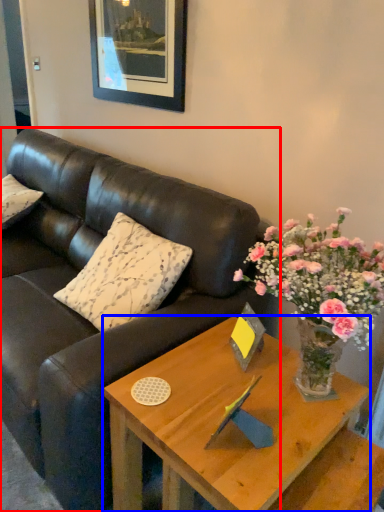
Question: Which point is closer to the camera, studio couch (highlighted by a red box) or coffee table (highlighted by a blue box)?

Choices:
 (A) studio couch
 (B) coffee table

Answer: (B)